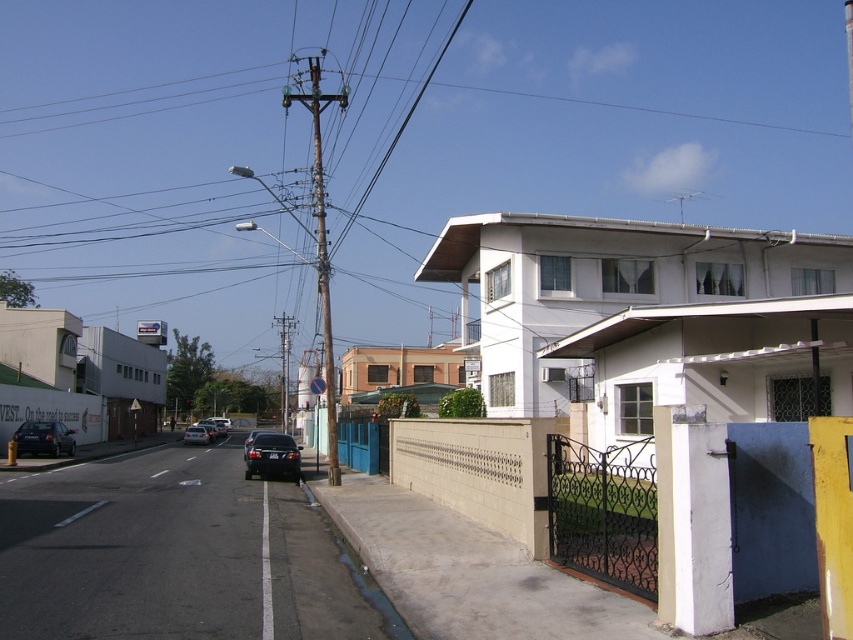
From the picture: You are a delivery person needing to deliver a package to the shiny silver sedan at center. The metallic utility pole at center has a delivery locker. If you can carry the package 120 feet, can you walk from the locker to the sedan without needing to rest?

The distance between the metallic utility pole at center and the shiny silver sedan at center is 114.27 feet. Since you can carry the package 120 feet, you can walk the 114.27 feet distance without needing to rest.

You are a pedestrian standing at the crosswalk on the right side of the road. You need to cross to the shiny black sedan at left and then to the shiny black sedan at center. Which sedan should you approach first based on their sizes?

The shiny black sedan at left has a smaller size compared to the shiny black sedan at center. Therefore, you should approach the shiny black sedan at left first since it is smaller and easier to navigate around.